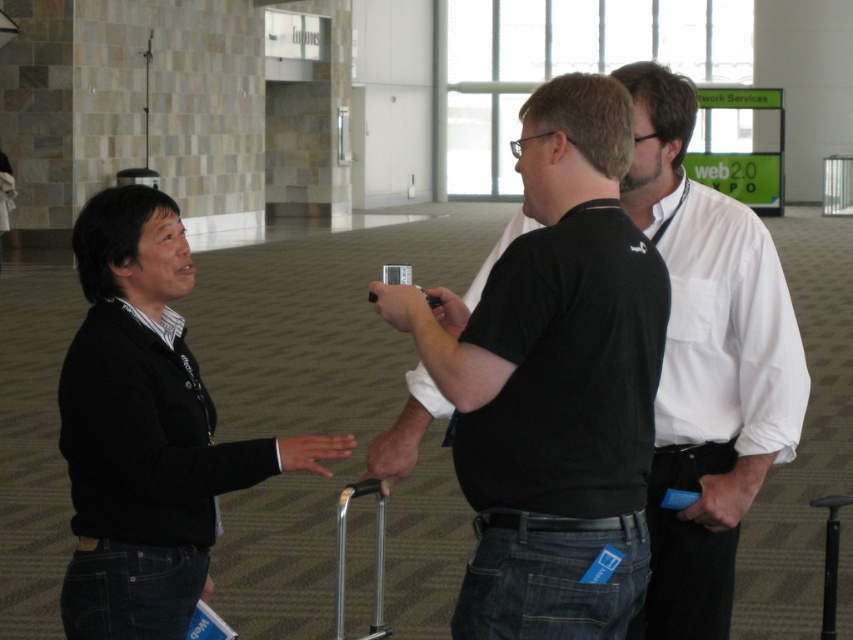
Which is above, black matte shirt at center or black sweater at left?

black matte shirt at center is higher up.

Is black matte shirt at center positioned behind black sweater at left?

Yes, black matte shirt at center is behind black sweater at left.

Does point (370, 451) lie behind point (136, 348)?

Yes, it is.

This screenshot has width=853, height=640. Find the location of `black matte shirt at center`. black matte shirt at center is located at coordinates (706, 364).